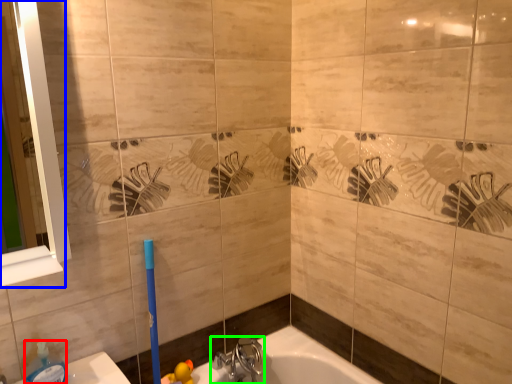
Question: Estimate the real-world distances between objects in this image. Which object is farther from soap dispenser (highlighted by a red box), mirror (highlighted by a blue box) or tap (highlighted by a green box)?

Choices:
 (A) mirror
 (B) tap

Answer: (B)